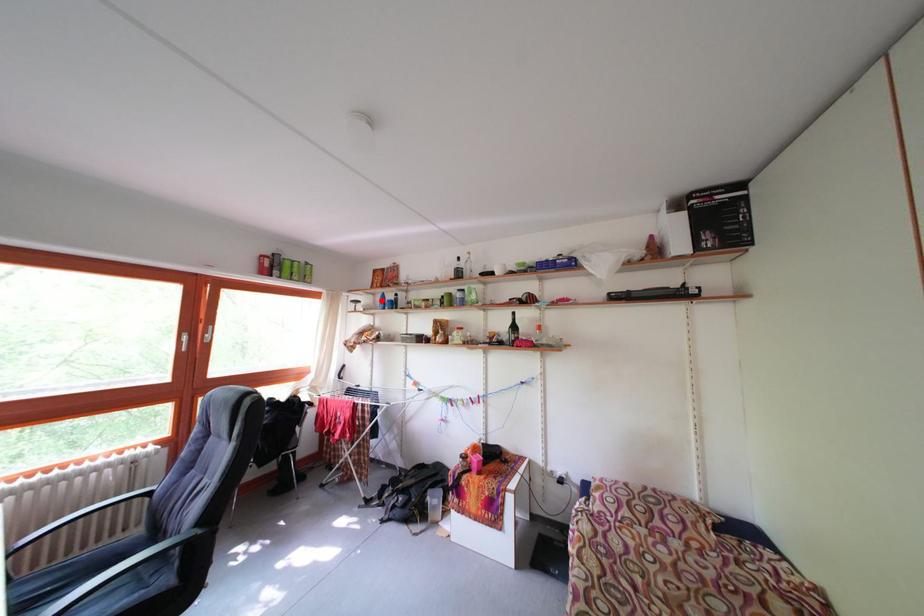
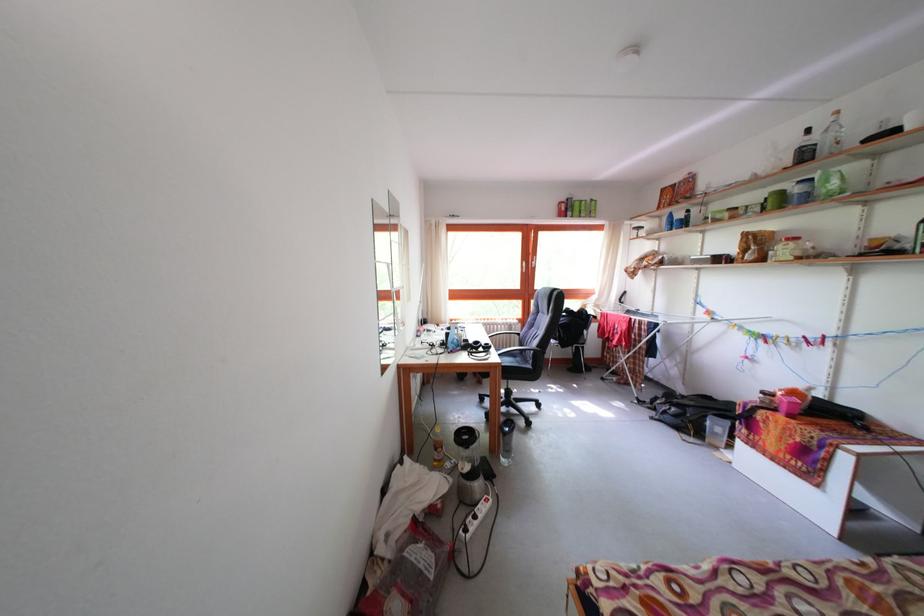
Where in the second image is the point corresponding to the highlighted location from the first image?

(667, 224)